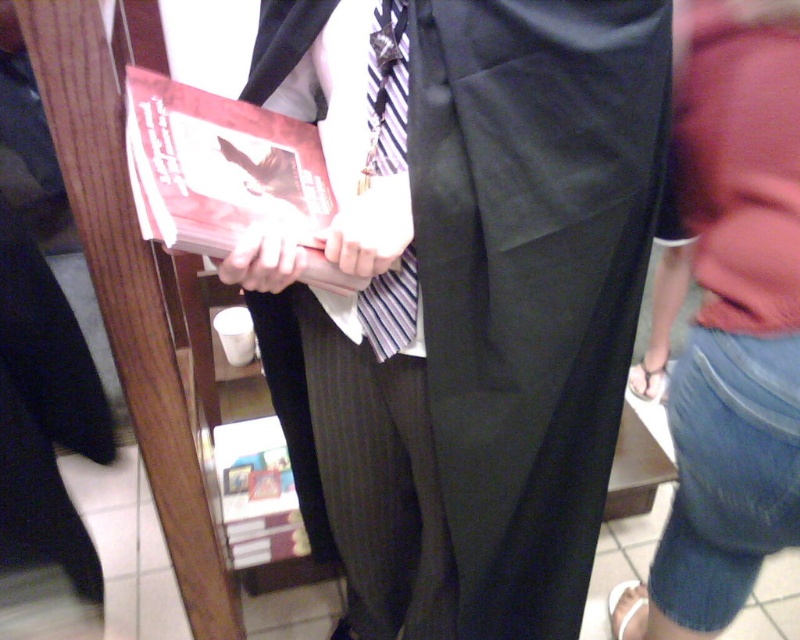
Question: Can you confirm if black satin pants at center is smaller than matte black hand at center?

Choices:
 (A) yes
 (B) no

Answer: (B)

Question: Which of the following is the farthest from the observer?

Choices:
 (A) (370, 262)
 (B) (245, 289)
 (C) (742, 580)

Answer: (C)

Question: Considering the relative positions of black satin pants at center and denim shorts at lower right in the image provided, where is black satin pants at center located with respect to denim shorts at lower right?

Choices:
 (A) right
 (B) left

Answer: (B)

Question: Does matte white hand at center appear on the left side of matte black hand at center?

Choices:
 (A) yes
 (B) no

Answer: (B)

Question: Estimate the real-world distances between objects in this image. Which object is closer to the matte black hand at center?

Choices:
 (A) denim shorts at lower right
 (B) black satin pants at center
 (C) striped fabric tie at center

Answer: (C)

Question: Which point appears farthest from the camera in this image?

Choices:
 (A) (401, 193)
 (B) (370, 291)

Answer: (B)